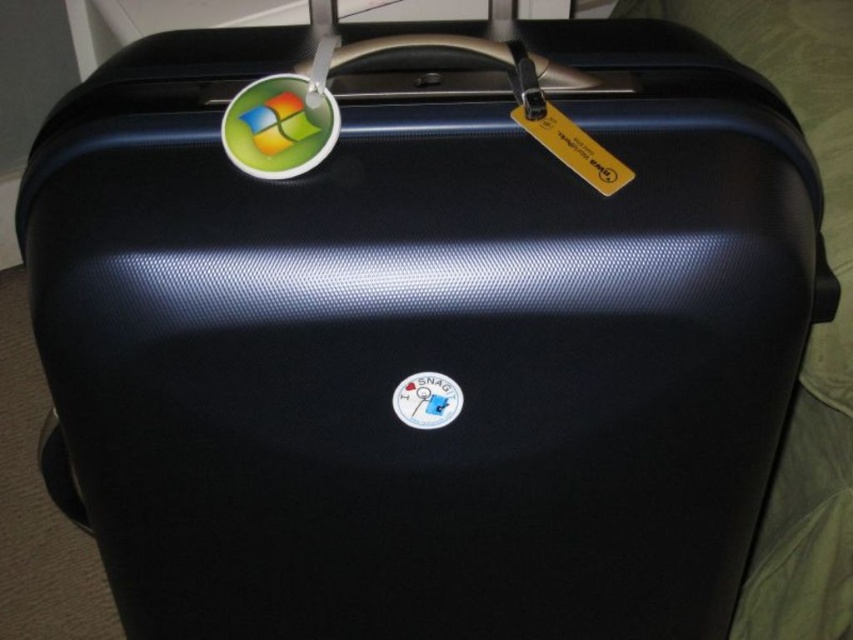
Question: Does yellow paper tag at upper center have a lesser width compared to white matte sticker at center?

Choices:
 (A) yes
 (B) no

Answer: (B)

Question: Which object is the farthest from the white matte sticker at center?

Choices:
 (A) shiny plastic sticker at top left
 (B) yellow paper tag at upper center

Answer: (A)

Question: Which of the following is the farthest from the observer?

Choices:
 (A) yellow paper tag at upper center
 (B) shiny plastic sticker at top left
 (C) white matte sticker at center

Answer: (C)

Question: Is yellow paper tag at upper center thinner than white matte sticker at center?

Choices:
 (A) yes
 (B) no

Answer: (B)

Question: Which point is closer to the camera?

Choices:
 (A) shiny plastic sticker at top left
 (B) white matte sticker at center
 (C) yellow paper tag at upper center

Answer: (A)

Question: Is shiny plastic sticker at top left wider than yellow paper tag at upper center?

Choices:
 (A) no
 (B) yes

Answer: (A)